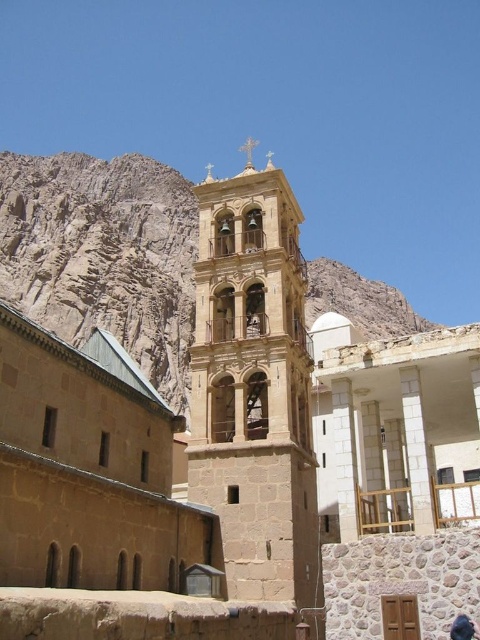
Can you confirm if stone bell tower at center is positioned above dark blue fabric at lower right?

Yes, stone bell tower at center is above dark blue fabric at lower right.

Identify the location of stone bell tower at center. The height and width of the screenshot is (640, 480). (253, 385).

Where is `stone bell tower at center`? Image resolution: width=480 pixels, height=640 pixels. stone bell tower at center is located at coordinates (253, 385).

Based on the photo, can you confirm if stone bell tower at center is positioned below brown rocky mountain at upper left?

Incorrect, stone bell tower at center is not positioned below brown rocky mountain at upper left.

I want to click on stone bell tower at center, so click(253, 385).

Measure the distance between point (240, 513) and camera.

128.31 feet

The width and height of the screenshot is (480, 640). I want to click on stone bell tower at center, so click(x=253, y=385).

This screenshot has width=480, height=640. Describe the element at coordinates (104, 253) in the screenshot. I see `brown rocky mountain at upper left` at that location.

Does brown rocky mountain at upper left have a larger size compared to dark blue fabric at lower right?

Yes.

Between point (87, 323) and point (460, 628), which one is positioned behind?

The point (87, 323) is behind.

What are the coordinates of `brown rocky mountain at upper left` in the screenshot? It's located at (104, 253).